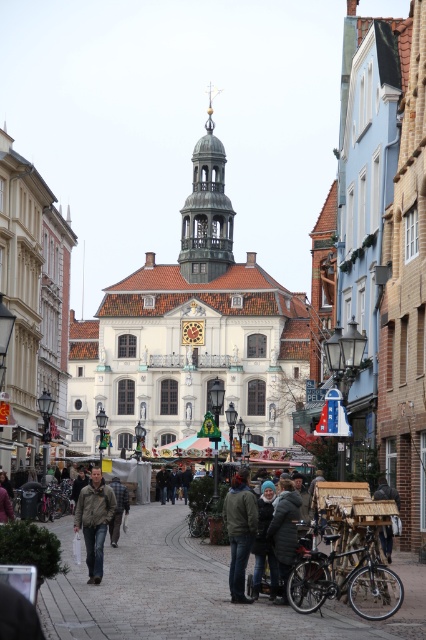
Which is in front, point (233, 502) or point (74, 524)?

Point (233, 502) is in front.

Is dark green jacket at center closer to camera compared to leather jacket at center?

That is True.

Which is in front, point (242, 536) or point (86, 516)?

Point (242, 536)

You are a GUI agent. You are given a task and a screenshot of the screen. Output one action in this format:
    pyautogui.click(x=<x>, y=<y>)
    Task: Click on the dark green jacket at center
    This screenshot has width=426, height=640.
    Given the screenshot: What is the action you would take?
    pyautogui.click(x=239, y=531)